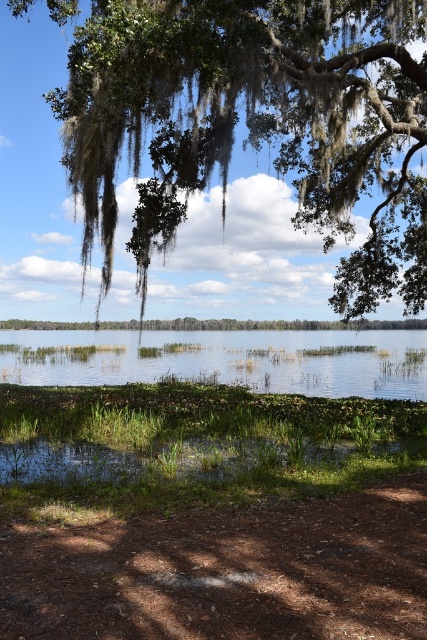
Does green mossy oak tree at upper left have a greater height compared to clear water at center?

→ Yes.

Who is lower down, green mossy oak tree at upper left or clear water at center?

clear water at center is lower down.

Measure the distance between point (424, 118) and camera.

Point (424, 118) and camera are 17.36 meters apart.

You are a GUI agent. You are given a task and a screenshot of the screen. Output one action in this format:
    pyautogui.click(x=<x>, y=<y>)
    Task: Click on the green mossy oak tree at upper left
    The width and height of the screenshot is (427, 640).
    Given the screenshot: What is the action you would take?
    pyautogui.click(x=251, y=129)